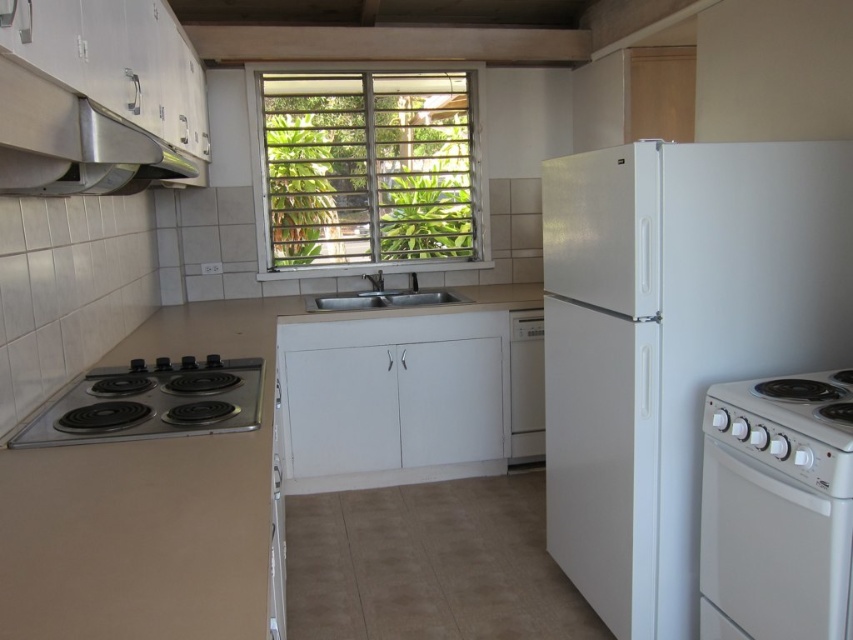
You are organizing the kitchen and need to place a new spice rack between the white glossy electric stove at lower right and the white matte sink at center. Based on their positions, where should you place the spice rack?

The white glossy electric stove at lower right is to the right of the white matte sink at center, so the spice rack should be placed between them, to the right of the sink and left of the stove.

You are a kitchen designer trying to install a new appliance that requires a space wider than the white matte sink at center. Can the white textured window at center provide enough space for this appliance?

The white textured window at center might be wider than the white matte sink at center, so it could potentially provide enough space for the appliance. However, since the exact width difference isn not specified, further measurements would be needed to confirm.